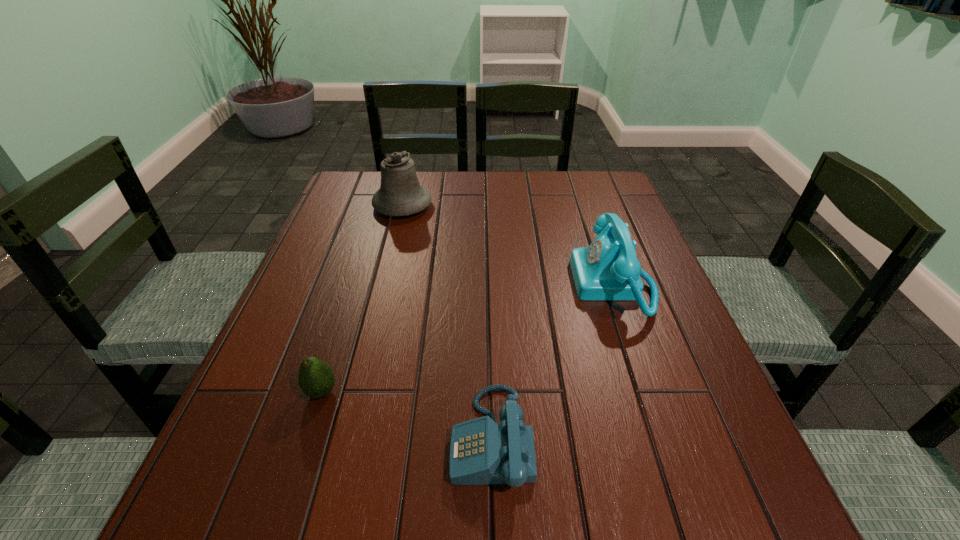
In order to click on bell in this screenshot , I will do `click(400, 194)`.

I want to click on the right telephone, so click(x=608, y=269).

Where is `the rightmost object`? This screenshot has width=960, height=540. the rightmost object is located at coordinates (608, 269).

Locate an element on the screen. Image resolution: width=960 pixels, height=540 pixels. avocado is located at coordinates (316, 378).

Identify the location of the shortest object. (482, 452).

Identify the location of the shorter telephone. (482, 452).

Where is `free spot located 0.100m on the right of the bell`? Image resolution: width=960 pixels, height=540 pixels. free spot located 0.100m on the right of the bell is located at coordinates (467, 206).

At what (x,y) coordinates should I click in order to perform the action: click on vacant space located on the dial of the third nearest object. Please return your answer as a coordinate pair (x, y). The width and height of the screenshot is (960, 540). Looking at the image, I should click on (540, 285).

Identify the location of vacant point located 0.230m on the dial of the third nearest object. (476, 285).

Locate an element on the screen. free space located on the dial of the third nearest object is located at coordinates (523, 285).